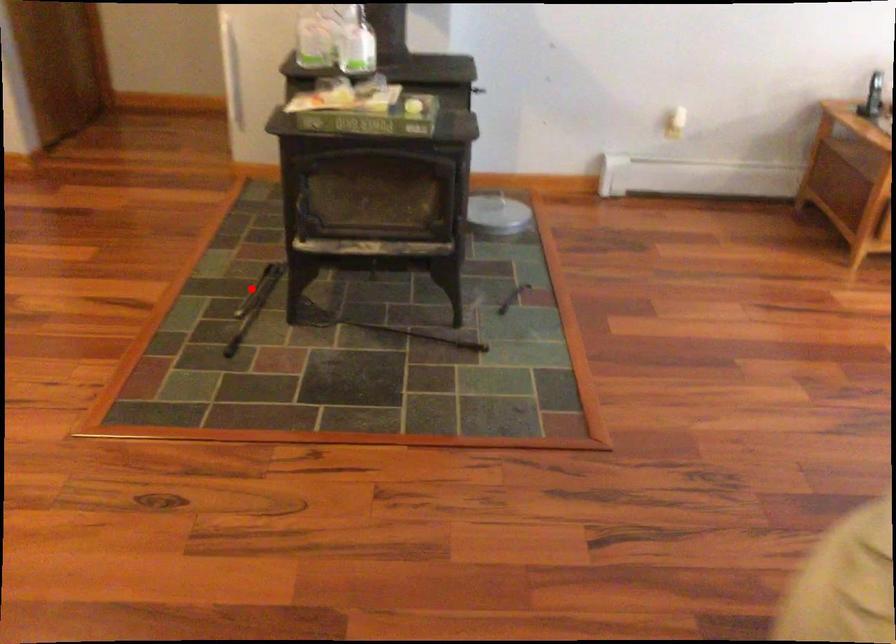
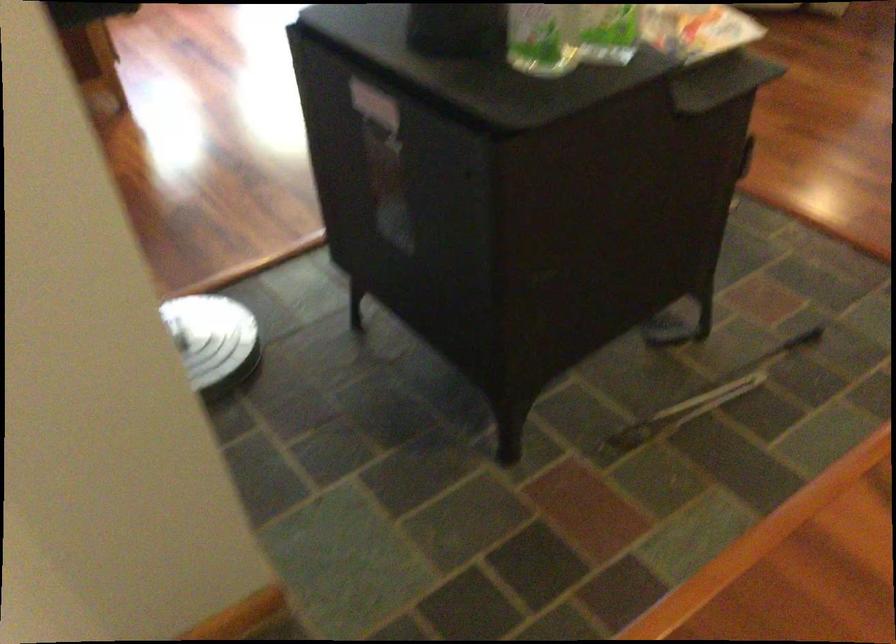
Question: A red point is marked in image1. In image2, is the corresponding 3D point closer to the camera or farther? Reply with the corresponding letter.

Choices:
 (A) The corresponding 3D point is closer.
 (B) The corresponding 3D point is farther.

Answer: (A)